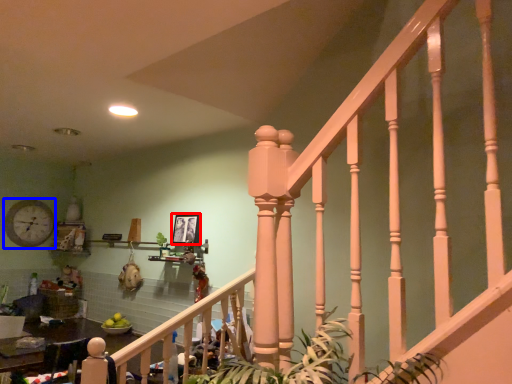
Question: Which of the following is the farthest to the observer, picture frame (highlighted by a red box) or clock (highlighted by a blue box)?

Choices:
 (A) picture frame
 (B) clock

Answer: (B)